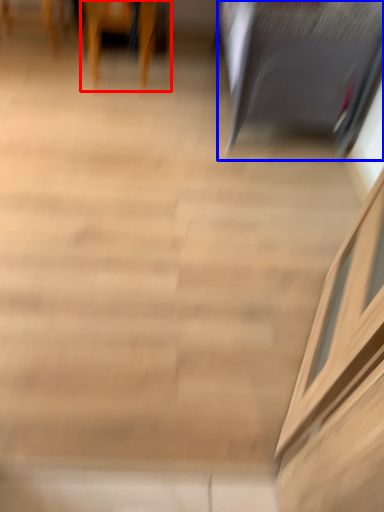
Question: Which object appears closest to the camera in this image, furniture (highlighted by a red box) or furniture (highlighted by a blue box)?

Choices:
 (A) furniture
 (B) furniture

Answer: (B)